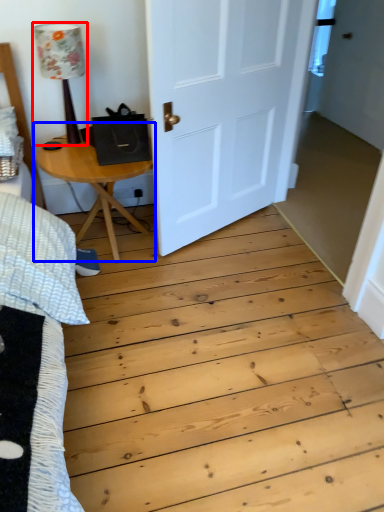
Question: Which point is closer to the camera, lamp (highlighted by a red box) or table (highlighted by a blue box)?

Choices:
 (A) lamp
 (B) table

Answer: (A)